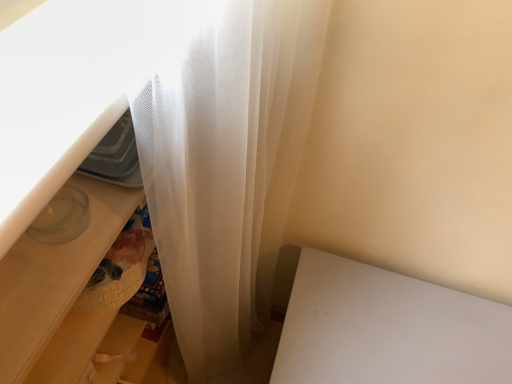
Image resolution: width=512 pixels, height=384 pixels. What do you see at coordinates (58, 292) in the screenshot? I see `translucent plastic drawer at lower left` at bounding box center [58, 292].

Find the location of a particular element. translucent plastic drawer at lower left is located at coordinates (58, 292).

Describe the element at coordinates (387, 329) in the screenshot. I see `white matte table at lower right` at that location.

I want to click on white matte table at lower right, so click(x=387, y=329).

Locate an element on the screen. translucent plastic drawer at lower left is located at coordinates (58, 292).

Based on the photo, between white matte table at lower right and translucent plastic drawer at lower left, which one appears on the left side from the viewer's perspective?

From the viewer's perspective, translucent plastic drawer at lower left appears more on the left side.

Is white matte table at lower right closer to the viewer compared to translucent plastic drawer at lower left?

No, it is behind translucent plastic drawer at lower left.

Which is behind, point (406, 296) or point (99, 180)?

The point (406, 296) is more distant.

From the image's perspective, is white matte table at lower right located above or below translucent plastic drawer at lower left?

From the image's perspective, white matte table at lower right appears below translucent plastic drawer at lower left.

From a real-world perspective, between white matte table at lower right and translucent plastic drawer at lower left, who is vertically lower?

white matte table at lower right is physically lower.

Considering the relative sizes of white matte table at lower right and translucent plastic drawer at lower left in the image provided, is white matte table at lower right wider than translucent plastic drawer at lower left?

Indeed, white matte table at lower right has a greater width compared to translucent plastic drawer at lower left.

Does white matte table at lower right have a greater height compared to translucent plastic drawer at lower left?

No.

Looking at this image, is white matte table at lower right smaller than translucent plastic drawer at lower left?

No, white matte table at lower right is not smaller than translucent plastic drawer at lower left.

Is white matte table at lower right positioned beyond the bounds of translucent plastic drawer at lower left?

white matte table at lower right is positioned outside translucent plastic drawer at lower left.

Looking at this image, is white matte table at lower right next to translucent plastic drawer at lower left?

No, white matte table at lower right is not in contact with translucent plastic drawer at lower left.

Is white matte table at lower right looking in the opposite direction of translucent plastic drawer at lower left?

→ No, white matte table at lower right's orientation is not away from translucent plastic drawer at lower left.

How distant is white matte table at lower right from translucent plastic drawer at lower left?

55.23 centimeters.

Locate an element on the screen. Image resolution: width=512 pixels, height=384 pixels. table that is on the right side of translucent plastic drawer at lower left is located at coordinates (387, 329).

Considering the relative positions of translucent plastic drawer at lower left and white matte table at lower right in the image provided, is translucent plastic drawer at lower left to the left or to the right of white matte table at lower right?

Based on their positions, translucent plastic drawer at lower left is located to the left of white matte table at lower right.

In the image, is translucent plastic drawer at lower left positioned in front of or behind white matte table at lower right?

translucent plastic drawer at lower left is in front of white matte table at lower right.

Is point (19, 312) positioned behind point (419, 288)?

No, (19, 312) is in front of (419, 288).

From the image's perspective, is translucent plastic drawer at lower left under white matte table at lower right?

No, from the image's perspective, translucent plastic drawer at lower left is not beneath white matte table at lower right.

From a real-world perspective, is translucent plastic drawer at lower left over white matte table at lower right?

Correct, in the physical world, translucent plastic drawer at lower left is higher than white matte table at lower right.

Does translucent plastic drawer at lower left have a lesser width compared to white matte table at lower right?

Indeed, translucent plastic drawer at lower left has a lesser width compared to white matte table at lower right.

Is translucent plastic drawer at lower left shorter than white matte table at lower right?

In fact, translucent plastic drawer at lower left may be taller than white matte table at lower right.

Is translucent plastic drawer at lower left smaller than white matte table at lower right?

Correct, translucent plastic drawer at lower left occupies less space than white matte table at lower right.

Is translucent plastic drawer at lower left outside of white matte table at lower right?

translucent plastic drawer at lower left is positioned outside white matte table at lower right.

Is translucent plastic drawer at lower left far away from white matte table at lower right?

No.

Is translucent plastic drawer at lower left oriented towards white matte table at lower right?

Yes, translucent plastic drawer at lower left is oriented towards white matte table at lower right.

How many degrees apart are the facing directions of translucent plastic drawer at lower left and white matte table at lower right?

The angular difference between translucent plastic drawer at lower left and white matte table at lower right is 89.8 degrees.

How much distance is there between translucent plastic drawer at lower left and white matte table at lower right?

They are 21.74 inches apart.

You are a GUI agent. You are given a task and a screenshot of the screen. Output one action in this format:
    pyautogui.click(x=<x>, y=<y>)
    Task: Click on the table that is under the translucent plastic drawer at lower left (from a real-world perspective)
    The width and height of the screenshot is (512, 384).
    Given the screenshot: What is the action you would take?
    pyautogui.click(x=387, y=329)

Identify the location of drawer above the white matte table at lower right (from a real-world perspective). (58, 292).

Where is `table below the translucent plastic drawer at lower left (from the image's perspective)`? The image size is (512, 384). table below the translucent plastic drawer at lower left (from the image's perspective) is located at coordinates (387, 329).